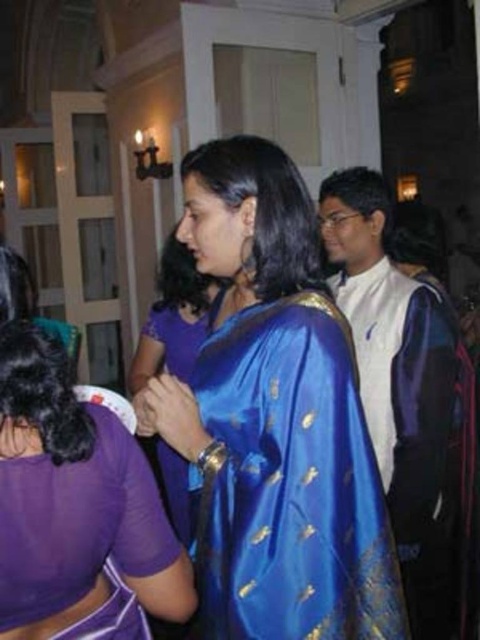
Can you confirm if blue silk saree at center is positioned to the right of blue silk sari at center?

No, blue silk saree at center is not to the right of blue silk sari at center.

Does blue silk saree at center have a lesser height compared to blue silk sari at center?

Yes.

Does point (276, 285) come closer to viewer compared to point (409, 557)?

Yes.

Find the location of a particular element. The width and height of the screenshot is (480, 640). blue silk saree at center is located at coordinates (275, 419).

Is purple satin blouse at lower left positioned before satin blue saree at center?

Yes, it is in front of satin blue saree at center.

Between purple satin blouse at lower left and satin blue saree at center, which one appears on the right side from the viewer's perspective?

Positioned to the right is purple satin blouse at lower left.

Is point (0, 477) closer to viewer compared to point (184, 356)?

Yes, point (0, 477) is in front of point (184, 356).

Where is `purple satin blouse at lower left`? The width and height of the screenshot is (480, 640). purple satin blouse at lower left is located at coordinates (74, 502).

Who is taller, purple satin blouse at lower left or blue silk sari at center?

Standing taller between the two is blue silk sari at center.

Can you confirm if purple satin blouse at lower left is taller than blue silk sari at center?

No, purple satin blouse at lower left is not taller than blue silk sari at center.

At what (x,y) coordinates should I click in order to perform the action: click on purple satin blouse at lower left. Please return your answer as a coordinate pair (x, y). Looking at the image, I should click on (74, 502).